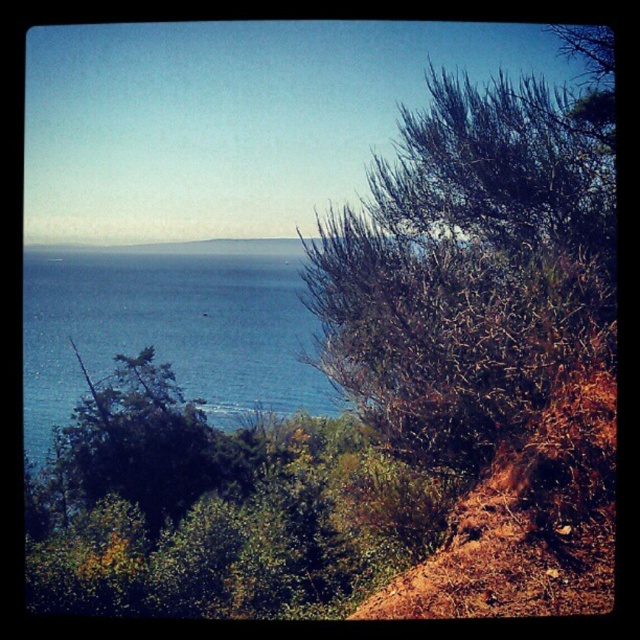
Is brown/dry bush at right thinner than green leafy tree at left?

Correct, brown/dry bush at right's width is less than green leafy tree at left's.

Is brown/dry bush at right wider than green leafy tree at left?

No.

Is point (529, 381) farther from camera compared to point (106, 474)?

No, (529, 381) is in front of (106, 474).

I want to click on brown/dry bush at right, so click(474, 260).

Is brown/dry bush at right shorter than blue water at left?

Incorrect, brown/dry bush at right's height does not fall short of blue water at left's.

Is brown/dry bush at right thinner than blue water at left?

Yes, brown/dry bush at right is thinner than blue water at left.

This screenshot has height=640, width=640. Describe the element at coordinates (474, 260) in the screenshot. I see `brown/dry bush at right` at that location.

You are a GUI agent. You are given a task and a screenshot of the screen. Output one action in this format:
    pyautogui.click(x=<x>, y=<y>)
    Task: Click on the brown/dry bush at right
    The height and width of the screenshot is (640, 640).
    Given the screenshot: What is the action you would take?
    pyautogui.click(x=474, y=260)

Looking at this image, who is positioned more to the left, blue water at left or green leafy tree at left?

From the viewer's perspective, blue water at left appears more on the left side.

Does point (296, 396) lie in front of point (96, 410)?

That is False.

You are a GUI agent. You are given a task and a screenshot of the screen. Output one action in this format:
    pyautogui.click(x=<x>, y=<y>)
    Task: Click on the blue water at left
    This screenshot has height=640, width=640.
    Given the screenshot: What is the action you would take?
    pyautogui.click(x=170, y=326)